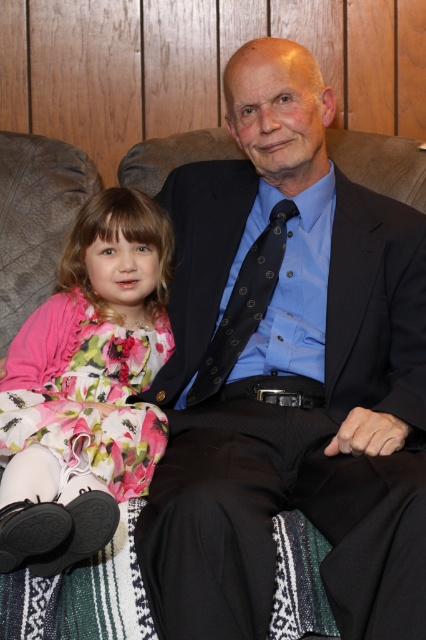
You are taking a photo of the two people on the couch. Which object, the matte black suit at center or the floral fabric dress at left, will appear larger in the photo?

The matte black suit at center will appear larger in the photo because it is closer to the viewer than the floral fabric dress at left.

You are a photographer setting up for a group photo. You need to ensure that the matte black suit at center and the black textured tie at center are both clearly visible. Considering their widths, which object should you focus on first to ensure proper framing?

The matte black suit at center is wider than the black textured tie at center, so you should focus on the matte black suit at center first to ensure proper framing.

You are a photographer trying to capture a portrait of the two subjects. Given that the matte black suit at center and the floral fabric dress at left must be clearly visible, which subject should you focus on to ensure both are in focus?

The matte black suit at center is bigger than the floral fabric dress at left, so focusing on the larger subject, the matte black suit at center, will ensure both are in focus.